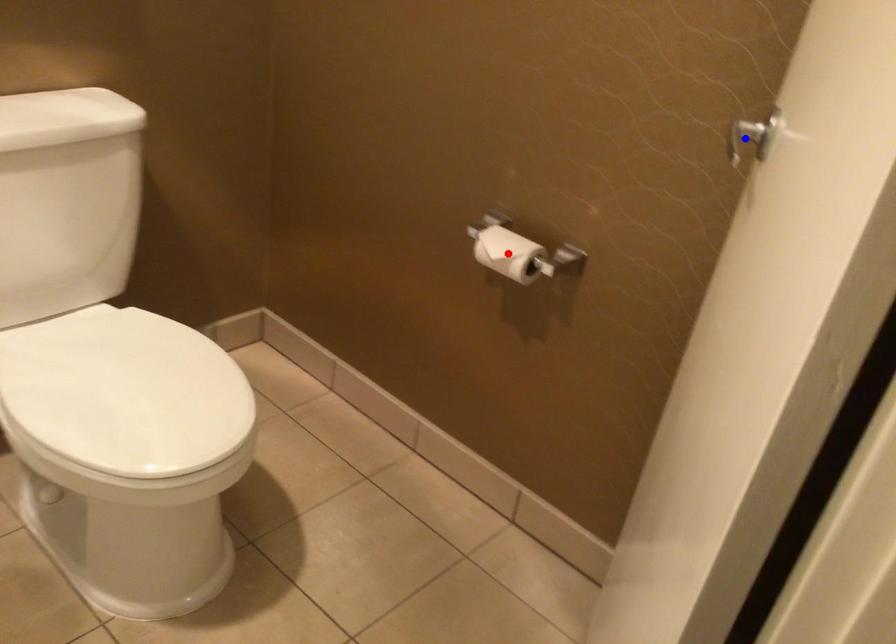
Question: Which of the two points in the image is closer to the camera?

Choices:
 (A) Blue point is closer.
 (B) Red point is closer.

Answer: (A)